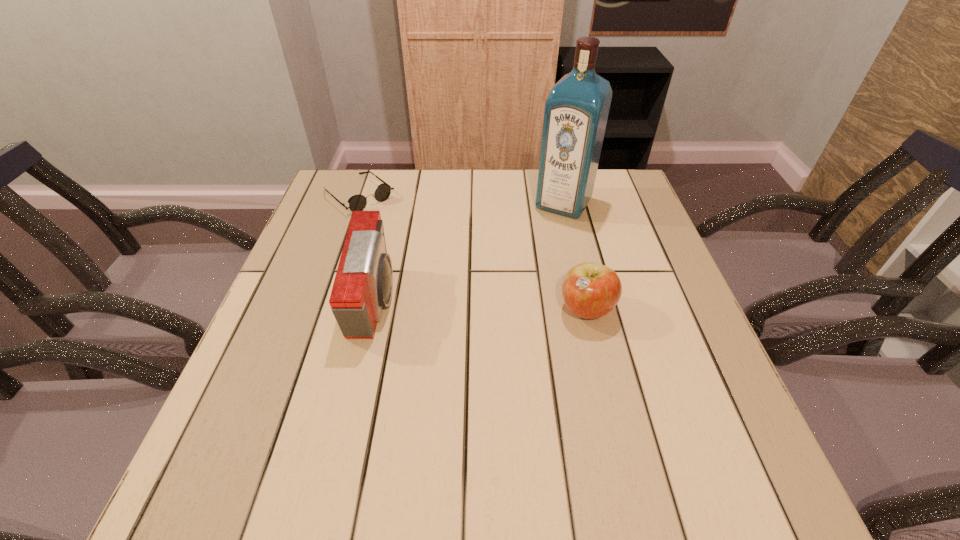
Identify the location of the second tallest object. The width and height of the screenshot is (960, 540). (363, 284).

This screenshot has height=540, width=960. I want to click on the third tallest object, so click(590, 290).

Locate an element on the screen. The width and height of the screenshot is (960, 540). the tallest object is located at coordinates (576, 111).

Find the location of a particular element. sunglasses is located at coordinates (358, 202).

Locate an element on the screen. vacant space situated 0.080m on the front-facing side of the third shortest object is located at coordinates (430, 302).

You are a GUI agent. You are given a task and a screenshot of the screen. Output one action in this format:
    pyautogui.click(x=<x>, y=<y>)
    Task: Click on the free region located on the front of the third tallest object
    The image size is (960, 540).
    Given the screenshot: What is the action you would take?
    pyautogui.click(x=598, y=362)

Image resolution: width=960 pixels, height=540 pixels. What are the coordinates of `free space located 0.280m on the flat label side of the liquor` in the screenshot? It's located at [514, 283].

Where is `free space located on the flat label side of the liquor`? The image size is (960, 540). free space located on the flat label side of the liquor is located at coordinates (495, 312).

You are a GUI agent. You are given a task and a screenshot of the screen. Output one action in this format:
    pyautogui.click(x=<x>, y=<y>)
    Task: Click on the vacant space located on the flat label side of the liquor
    
    Given the screenshot: What is the action you would take?
    pyautogui.click(x=507, y=294)

Find the location of a particular element. vacant space located 0.120m on the front-facing side of the shortest object is located at coordinates (403, 231).